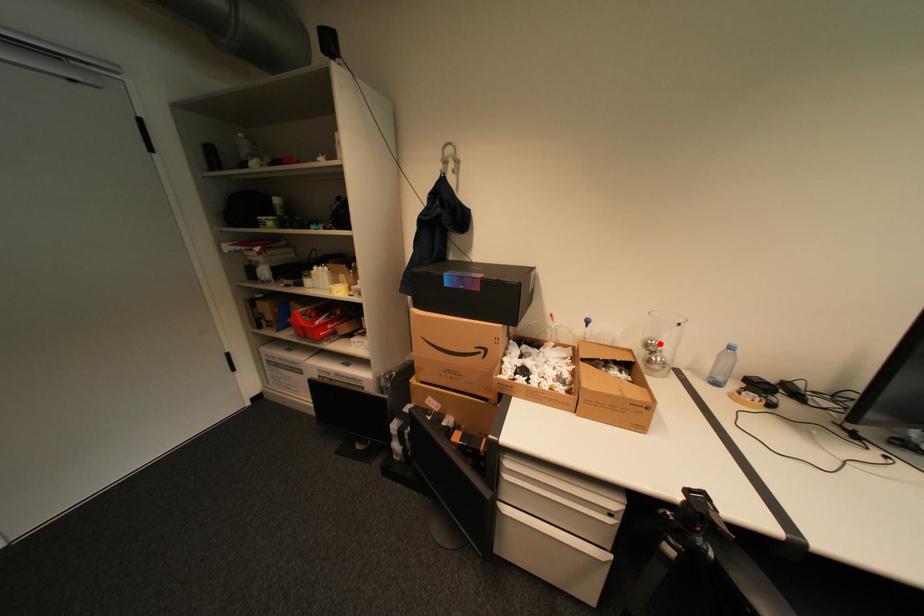
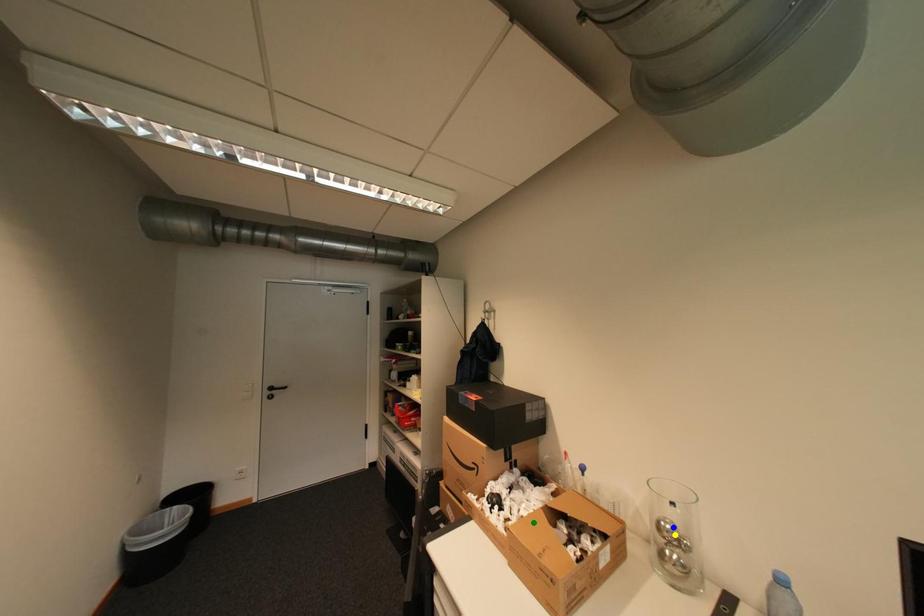
Question: I am providing you with two images of the same scene from different viewpoints. A red point is marked on the first image. You are given multiple points on the second image. Which spot in image 2 lines up with the point in image 1?

Choices:
 (A) yellow point
 (B) green point
 (C) blue point

Answer: (C)